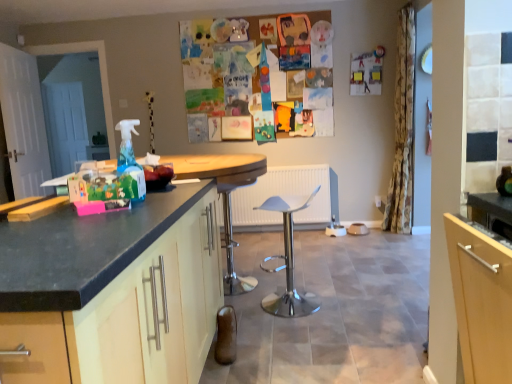
The width and height of the screenshot is (512, 384). Identify the location of empty space that is to the right of white glossy swivel chair at center. (339, 304).